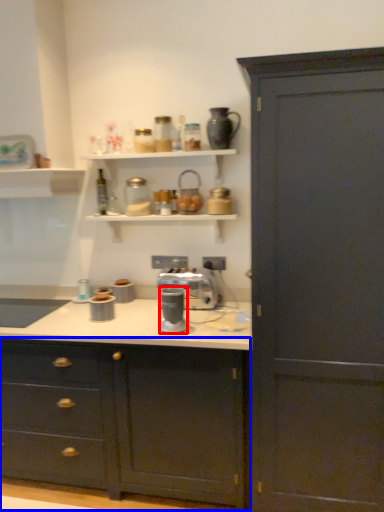
Question: Which of the following is the farthest to the observer, coffee machine (highlighted by a red box) or cabinetry (highlighted by a blue box)?

Choices:
 (A) coffee machine
 (B) cabinetry

Answer: (A)